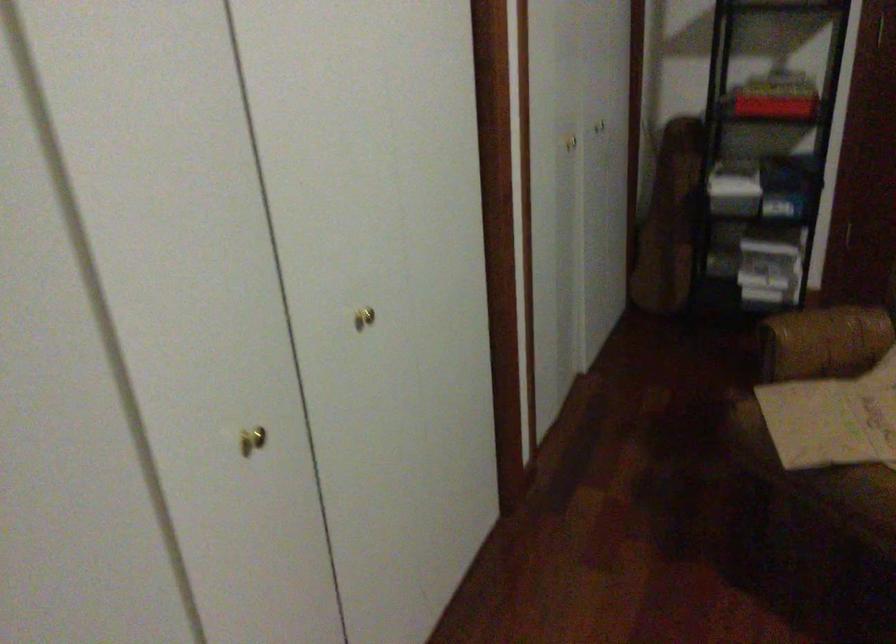
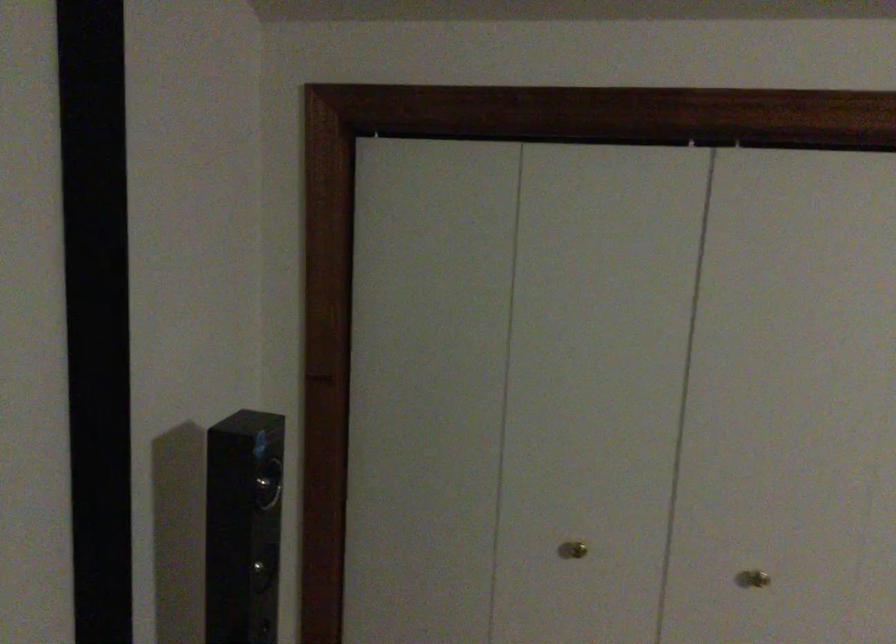
Question: The images are taken continuously from a first-person perspective. In which direction is your viewpoint rotating?

Choices:
 (A) Left
 (B) Right
 (C) Up
 (D) Down

Answer: (A)